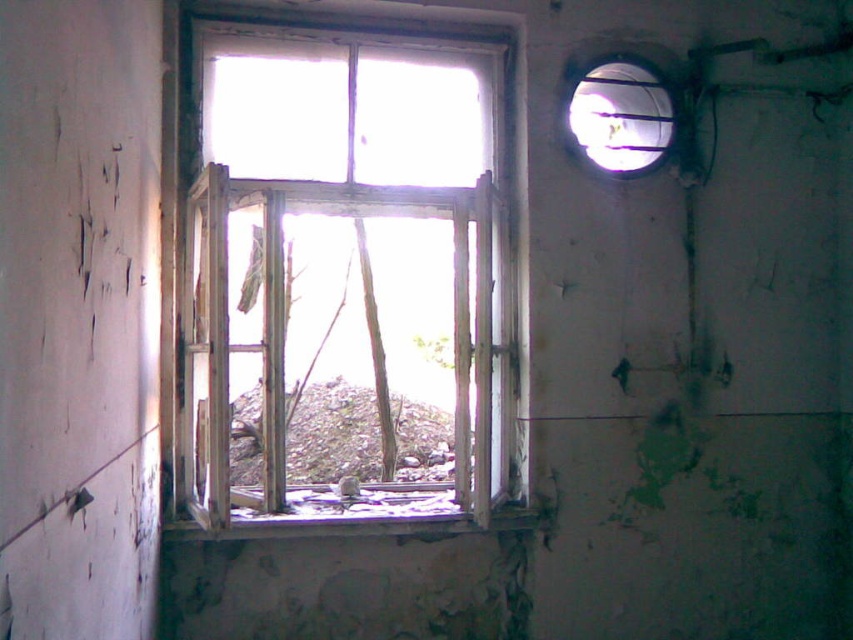
You are a contractor assessing the building and notice the weathered wood window at center and the rusty metallic debris at center. Which object is closer to you?

The weathered wood window at center is closer to you than the rusty metallic debris at center.

You are an inspector assessing the structural integrity of the building. You notice the weathered wood window at center and the rusty metallic debris at center. Which object is wider?

The rusty metallic debris at center is wider than the weathered wood window at center.